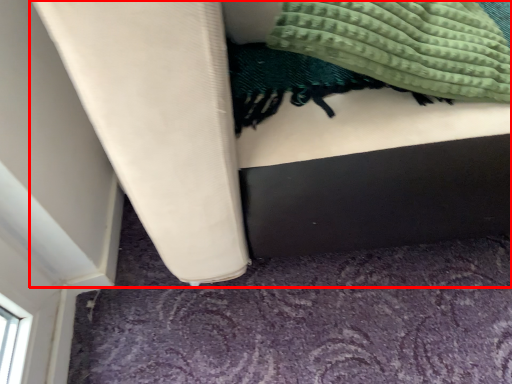
Question: Considering the relative positions of furniture (annotated by the red box) and blanket in the image provided, where is furniture (annotated by the red box) located with respect to the staircase?

Choices:
 (A) left
 (B) right

Answer: (B)